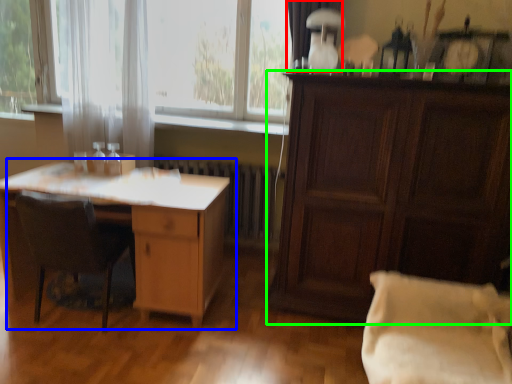
Question: Estimate the real-world distances between objects in this image. Which object is closer to curtain (highlighted by a red box), desk (highlighted by a blue box) or cabinetry (highlighted by a green box)?

Choices:
 (A) desk
 (B) cabinetry

Answer: (B)